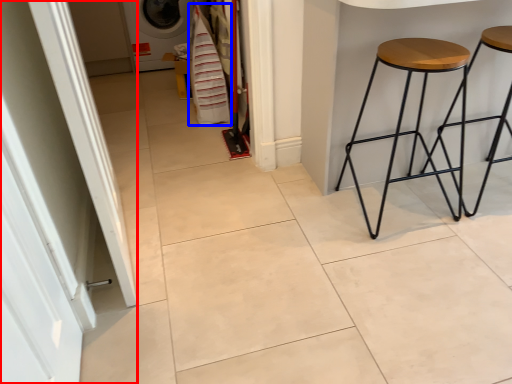
Question: Which object is closer to the camera taking this photo, screen door (highlighted by a red box) or laundry (highlighted by a blue box)?

Choices:
 (A) screen door
 (B) laundry

Answer: (A)